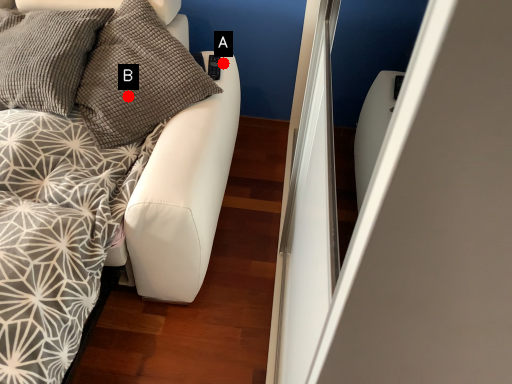
Question: Two points are circled on the image, labeled by A and B beside each circle. Which point is closer to the camera?

Choices:
 (A) A is closer
 (B) B is closer

Answer: (B)